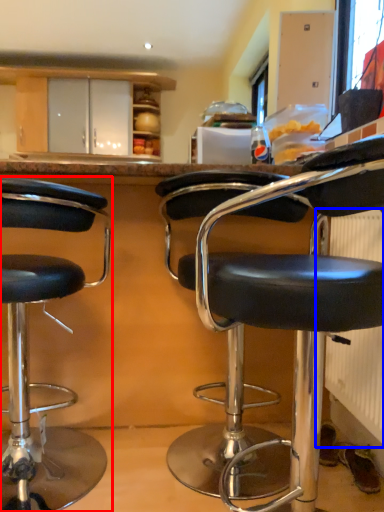
Question: Which point is closer to the camera, chair (highlighted by a red box) or radiator (highlighted by a blue box)?

Choices:
 (A) chair
 (B) radiator

Answer: (A)